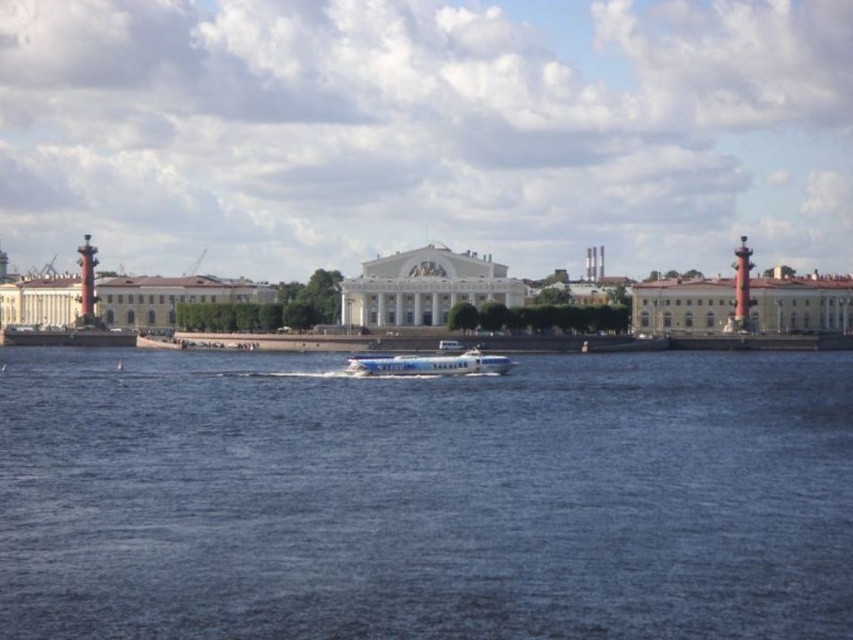
Which is above, blue water at center or white glossy building at center?

white glossy building at center is above.

Can you confirm if blue water at center is bigger than white glossy building at center?

Yes, blue water at center is bigger than white glossy building at center.

Is point (347, 540) positioned in front of point (509, 305)?

Yes, it is.

Identify the location of blue water at center. The height and width of the screenshot is (640, 853). (424, 497).

Does white glossy building at center have a lesser height compared to white glossy boat at center?

Incorrect, white glossy building at center's height does not fall short of white glossy boat at center's.

Which is above, white glossy building at center or white glossy boat at center?

white glossy building at center

What are the coordinates of `white glossy building at center` in the screenshot? It's located at (424, 285).

This screenshot has height=640, width=853. Find the location of `white glossy building at center`. white glossy building at center is located at coordinates (x=424, y=285).

Who is higher up, blue water at center or white glossy boat at center?

white glossy boat at center

Measure the distance between blue water at center and white glossy boat at center.

They are 27.77 meters apart.

Between point (387, 394) and point (422, 364), which one is positioned behind?

The point (422, 364) is behind.

Locate an element on the screen. The height and width of the screenshot is (640, 853). blue water at center is located at coordinates (424, 497).